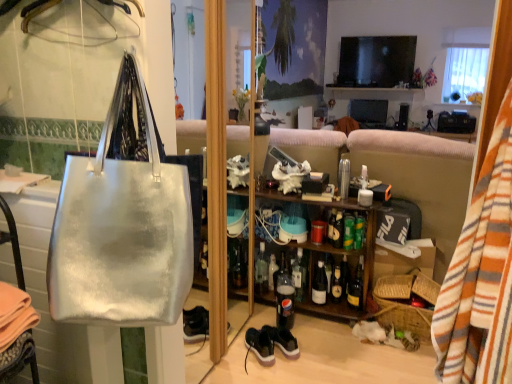
Question: Is point (315, 243) positioned closer to the camera than point (317, 167)?

Choices:
 (A) closer
 (B) farther

Answer: (A)

Question: Is metallic silver cup at center wider or thinner than wooden shelf at center?

Choices:
 (A) thin
 (B) wide

Answer: (A)

Question: Considering the real-world distances, which object is farthest from the shiny black sneakers at lower center, arranged as the second sneakers when viewed from the left?

Choices:
 (A) matte cardboard box at lower right
 (B) translucent glass bottle at center, positioned as the seventh bottle in right-to-left order
 (C) striped cotton blanket at right
 (D) translucent glass bottle at center, the fourth bottle when ordered from left to right
 (E) shiny gold bottle at center, which is the 8th bottle in left-to-right order

Answer: (C)

Question: Which is farther from the shiny black sneakers at lower center, the 1th sneakers in the right-to-left sequence?

Choices:
 (A) wooden shelf at center
 (B) clear glass bottle at center, which is the 8th bottle in right-to-left order
 (C) satin white tote bag at left
 (D) translucent glass bottle at center, the third bottle positioned from the right
 (E) translucent glass bottle at center, arranged as the second bottle when viewed from the left

Answer: (C)